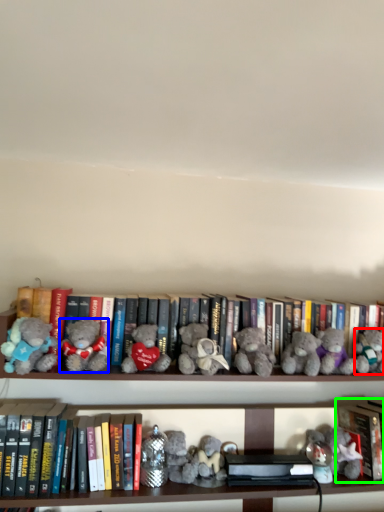
Question: Considering the real-world distances, which object is closest to toy (highlighted by a red box)? teddy bear (highlighted by a blue box) or book (highlighted by a green box).

Choices:
 (A) teddy bear
 (B) book

Answer: (B)